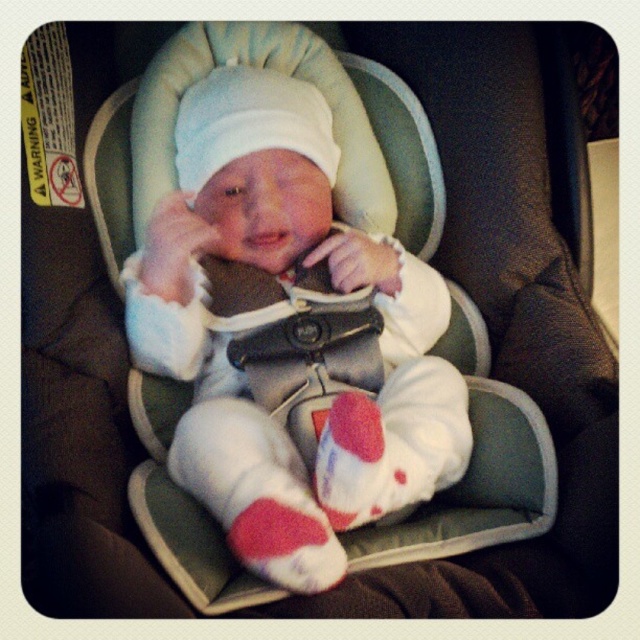
How much distance is there between white soft baby at center and red knit sock at lower center?

white soft baby at center is 10.02 inches from red knit sock at lower center.

Does point (211, 436) lie behind point (243, 556)?

Yes.

The height and width of the screenshot is (640, 640). I want to click on white soft baby at center, so click(x=276, y=324).